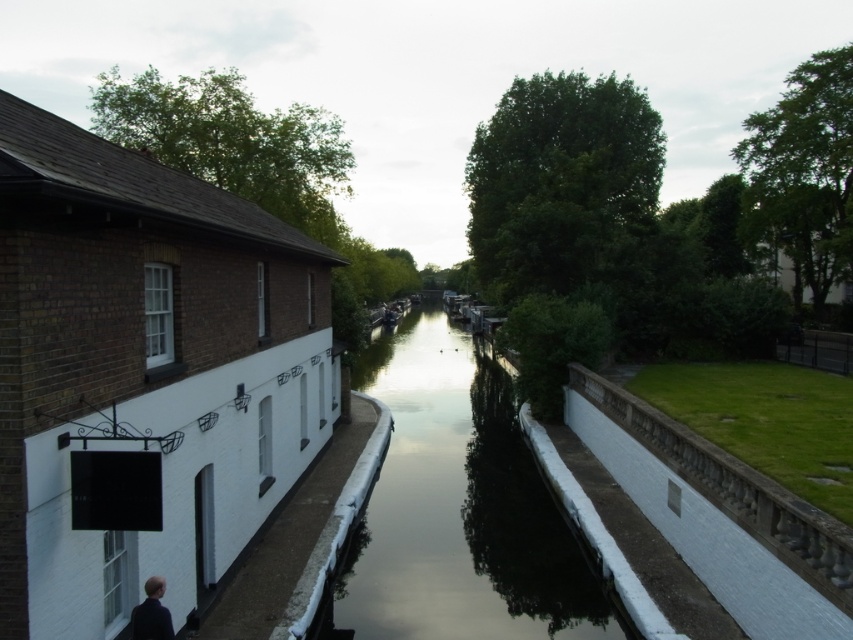
You are standing at point A, which is located at the coordinates of point (x=161, y=621). You want to move to point B, which is at point (x=462, y=625). However, there is an obstacle blocking your path. Can you reach point B without moving around the obstacle?

Point (x=462, y=625) is behind point (x=161, y=621), so you cannot reach point B directly without moving around the obstacle.

You are planning to cross the canal using a small wooden bridge that is 1.2 meters wide. Given the scene, will the bridge fit across the smooth concrete canal at center without touching the dark blue fabric person at lower left?

The smooth concrete canal at center is wider than the dark blue fabric person at lower left, so the bridge should fit across the canal without touching the person.

You are a delivery drone that needs to fly from the dark blue fabric person at lower left to the smooth concrete canal at center. What is the minimum distance you need to cover?

The minimum distance you need to cover is 10.35 meters between the dark blue fabric person at lower left and the smooth concrete canal at center.